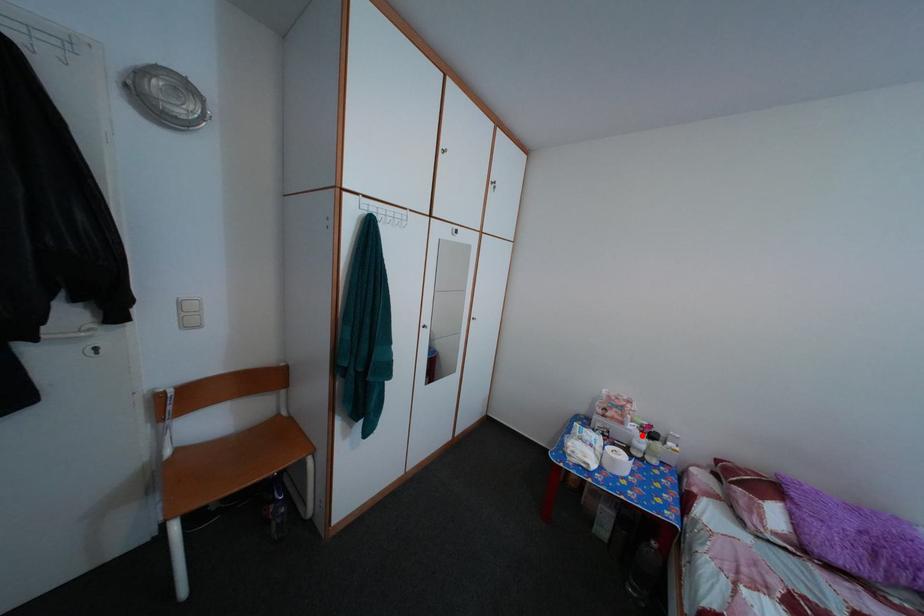
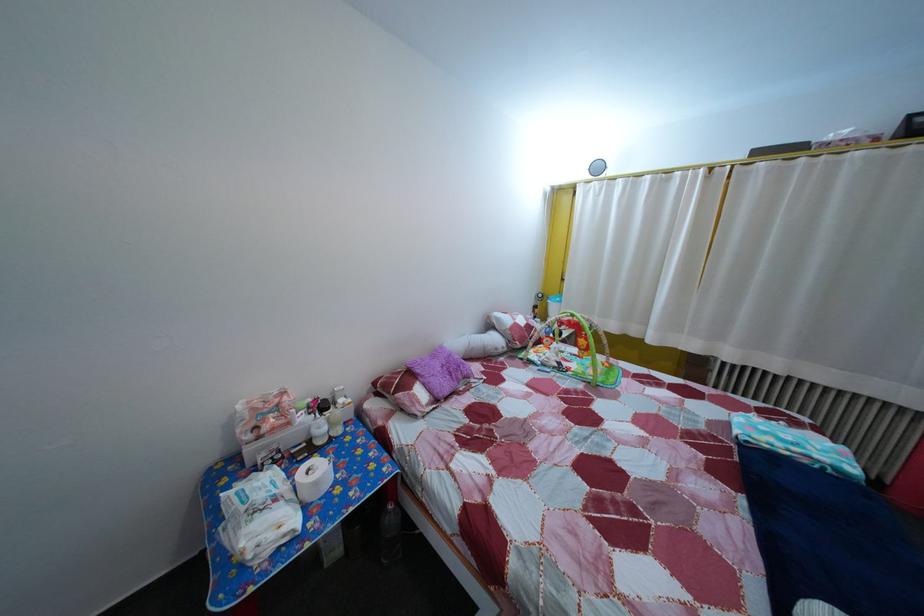
The point at the highlighted location is marked in the first image. Where is the corresponding point in the second image?

(311, 427)